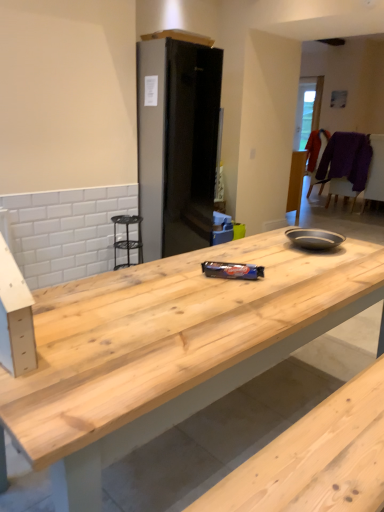
I want to click on blank space above natural wood countertop at center (from a real-world perspective), so click(254, 261).